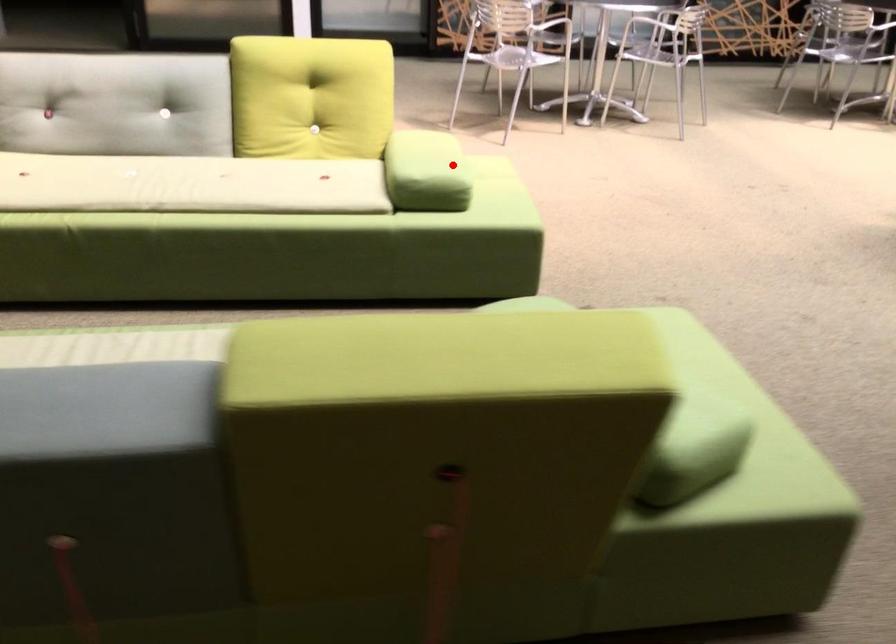
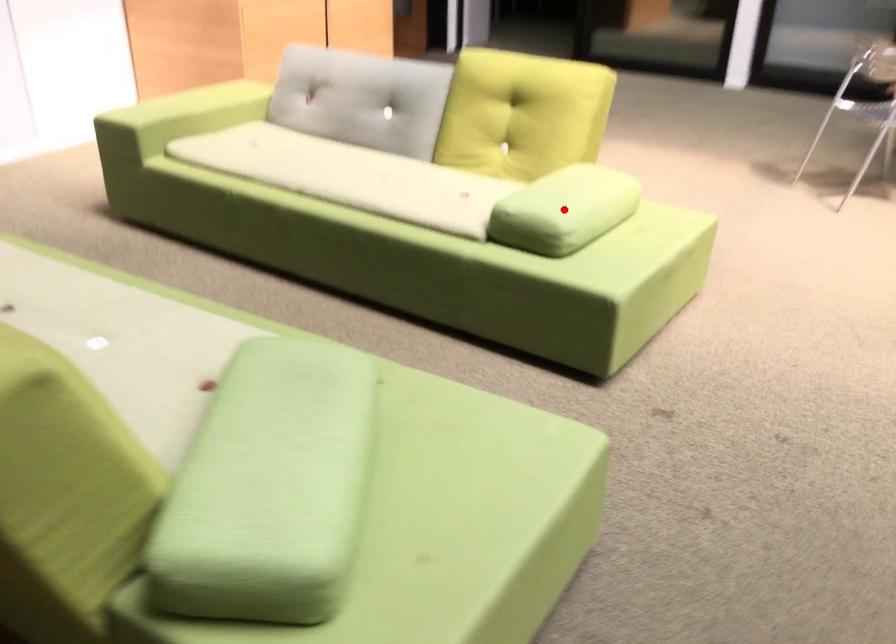
I am providing you with two images of the same scene from different viewpoints. A red point is marked on the first image and another point is marked on the second image. Does the point marked in image1 correspond to the same location as the one in image2?

Yes